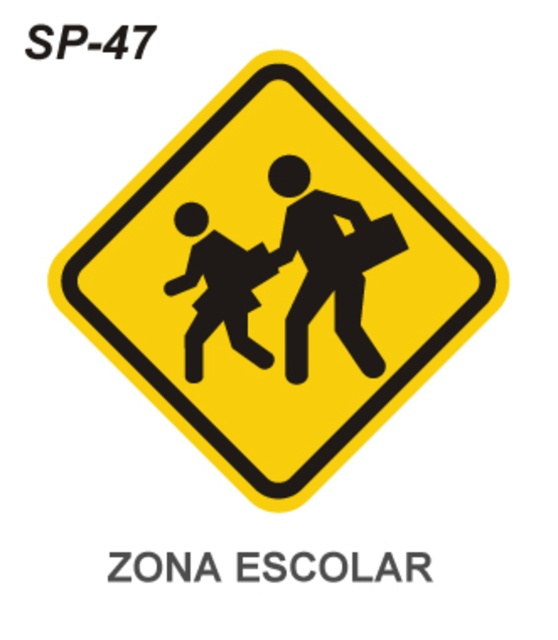
Question: Which point is closer to the camera?

Choices:
 (A) (253, 282)
 (B) (300, 179)
 (C) (180, 150)

Answer: (C)

Question: Does black silhouette at center appear under black silhouette at lower left?

Choices:
 (A) yes
 (B) no

Answer: (B)

Question: Which object is positioned farthest from the black silhouette at center?

Choices:
 (A) black silhouette at lower left
 (B) yellow matte sign at center

Answer: (A)

Question: Is yellow matte sign at center to the right of black silhouette at center from the viewer's perspective?

Choices:
 (A) no
 (B) yes

Answer: (A)

Question: Which point is closer to the camera?

Choices:
 (A) (191, 232)
 (B) (470, 296)
 (C) (310, 308)

Answer: (B)

Question: Does black silhouette at center appear over black silhouette at lower left?

Choices:
 (A) yes
 (B) no

Answer: (A)